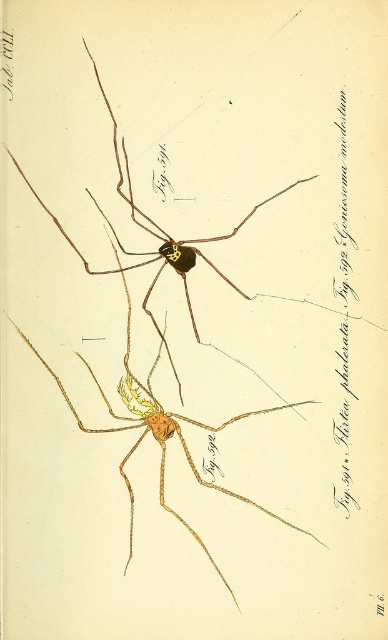
You are a researcher holding a ruler. You want to measure the distance between the brown matte spider at center and yourself. Based on the image, what is the approximate distance in feet?

The distance between the brown matte spider at center and the viewer is approximately 3.98 feet.